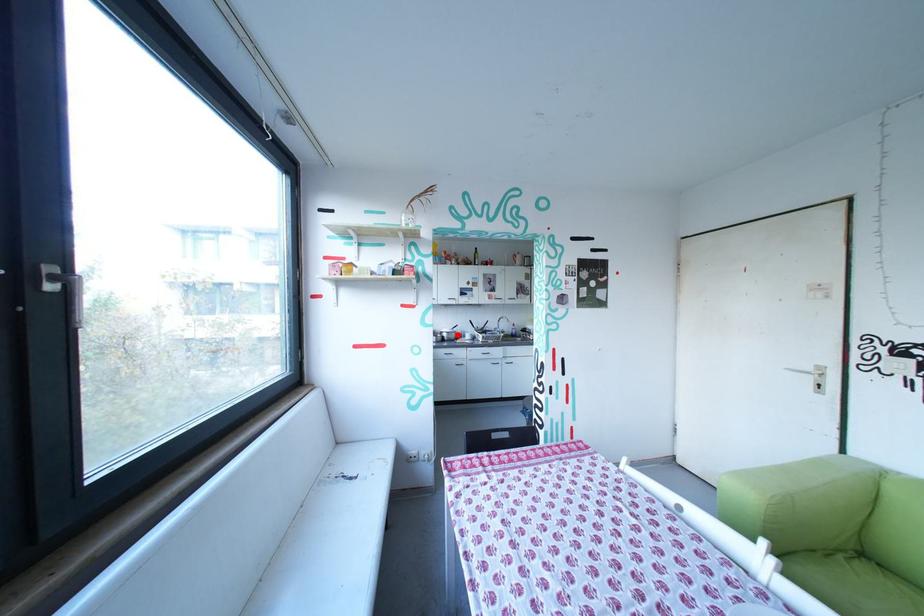
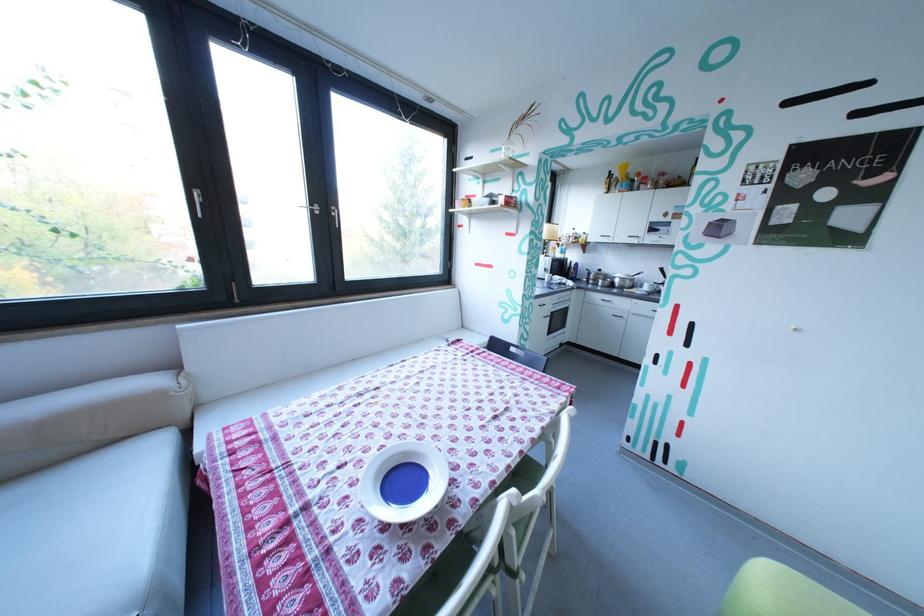
Question: I am providing you with two images of the same scene from different viewpoints. A red point is shown in image1. For the corresponding object point in image2, is it positioned nearer or farther from the camera?

Choices:
 (A) Nearer
 (B) Farther

Answer: (A)